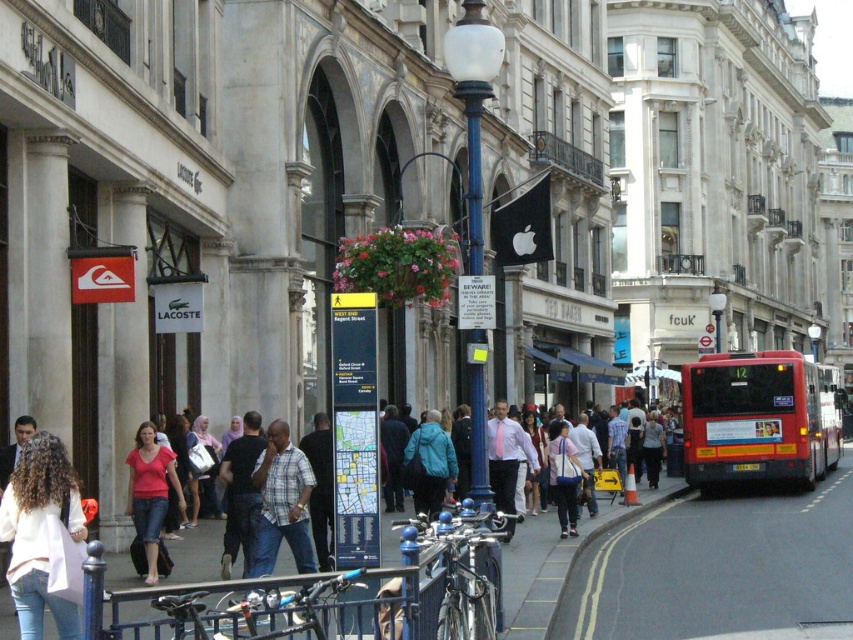
Does point (32, 484) come behind point (817, 368)?

No.

Who is shorter, white matte jacket at lower left or red metallic bus at right?

With less height is white matte jacket at lower left.

Between point (12, 552) and point (844, 388), which one is positioned in front?

Positioned in front is point (12, 552).

At what (x,y) coordinates should I click in order to perform the action: click on white matte jacket at lower left. Please return your answer as a coordinate pair (x, y). Looking at the image, I should click on (39, 532).

Is blue metal pole at center positioned at the back of teal fabric jacket at center?

No, blue metal pole at center is in front of teal fabric jacket at center.

Can you confirm if blue metal pole at center is thinner than teal fabric jacket at center?

Yes.

Locate an element on the screen. Image resolution: width=853 pixels, height=640 pixels. blue metal pole at center is located at coordinates (473, 104).

Where is `blue metal pole at center`? blue metal pole at center is located at coordinates (473, 104).

In the scene shown: Between blue metal pole at center and blue painted metal pole at center, which one appears on the left side from the viewer's perspective?

blue metal pole at center

Between blue metal pole at center and blue painted metal pole at center, which one is positioned higher?

blue painted metal pole at center

This screenshot has width=853, height=640. I want to click on blue metal pole at center, so click(x=473, y=104).